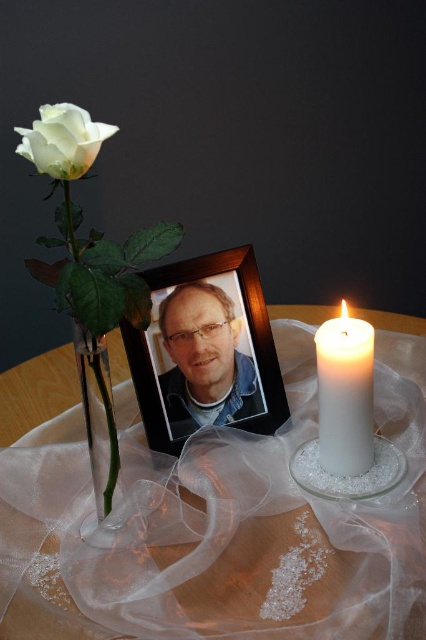
Question: Which point is farther to the camera?

Choices:
 (A) (377, 496)
 (B) (371, 529)

Answer: (A)

Question: Is wooden photo frame at center to the right of clear glass vase at left from the viewer's perspective?

Choices:
 (A) no
 (B) yes

Answer: (B)

Question: Which object appears closest to the camera in this image?

Choices:
 (A) white matte rose at upper left
 (B) matte black photo frame at center
 (C) wooden photo frame at center
 (D) clear glass candle at center

Answer: (A)

Question: Is wooden photo frame at center below matte black photo frame at center?

Choices:
 (A) yes
 (B) no

Answer: (B)

Question: Where is wooden photo frame at center located in relation to matte black photo frame at center in the image?

Choices:
 (A) below
 (B) above

Answer: (B)

Question: Among these points, which one is farthest from the camera?

Choices:
 (A) (181, 310)
 (B) (330, 472)
 (C) (57, 176)
 (D) (219, 348)

Answer: (D)